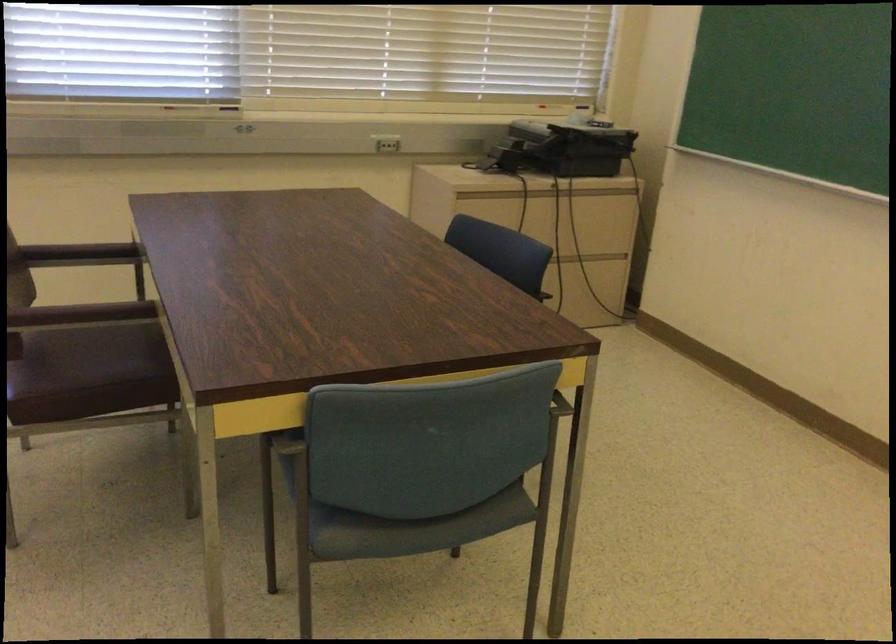
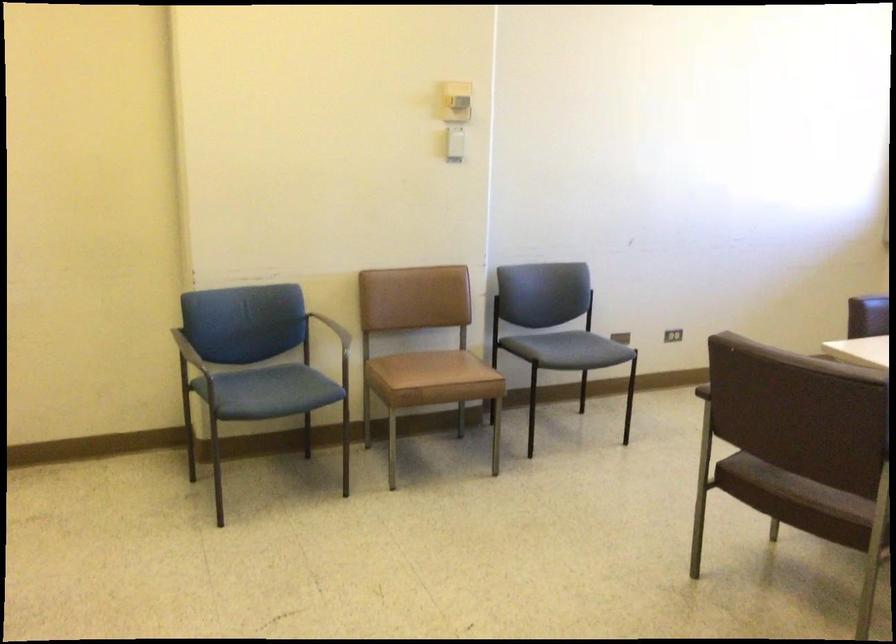
Question: The images are taken continuously from a first-person perspective. In which direction is your viewpoint rotating?

Choices:
 (A) Left
 (B) Right
 (C) Up
 (D) Down

Answer: (A)